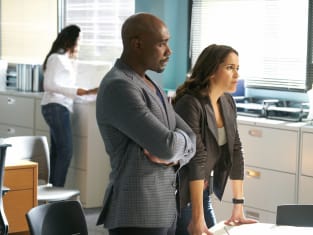
The height and width of the screenshot is (235, 313). Identify the location of blue painted walls. (167, 10), (288, 94).